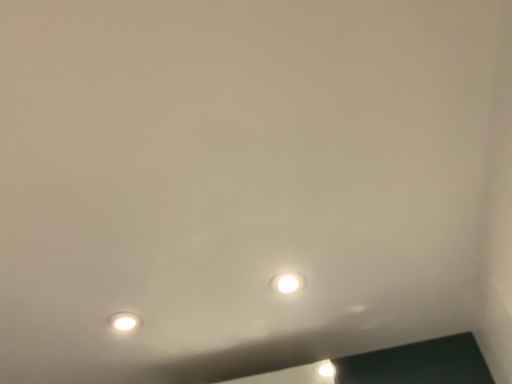
Looking at this image, in order to face white glossy light fixture at center, should I rotate leftwards or rightwards?

A 4.298 degree turn to the right will do.

What do you see at coordinates (287, 282) in the screenshot?
I see `white glossy light fixture at center` at bounding box center [287, 282].

Locate an element on the screen. white glossy light fixture at center is located at coordinates (287, 282).

The height and width of the screenshot is (384, 512). Find the location of `white glossy light fixture at center`. white glossy light fixture at center is located at coordinates (287, 282).